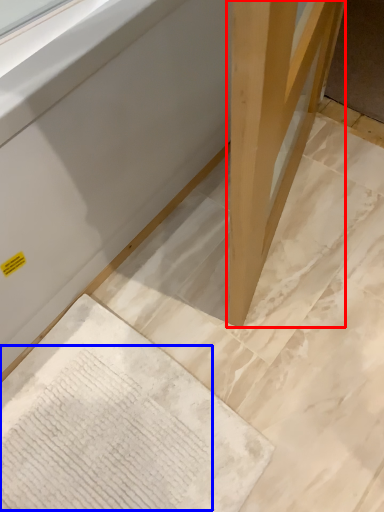
Question: Among these objects, which one is farthest to the camera, wood (highlighted by a red box) or writing (highlighted by a blue box)?

Choices:
 (A) wood
 (B) writing

Answer: (B)